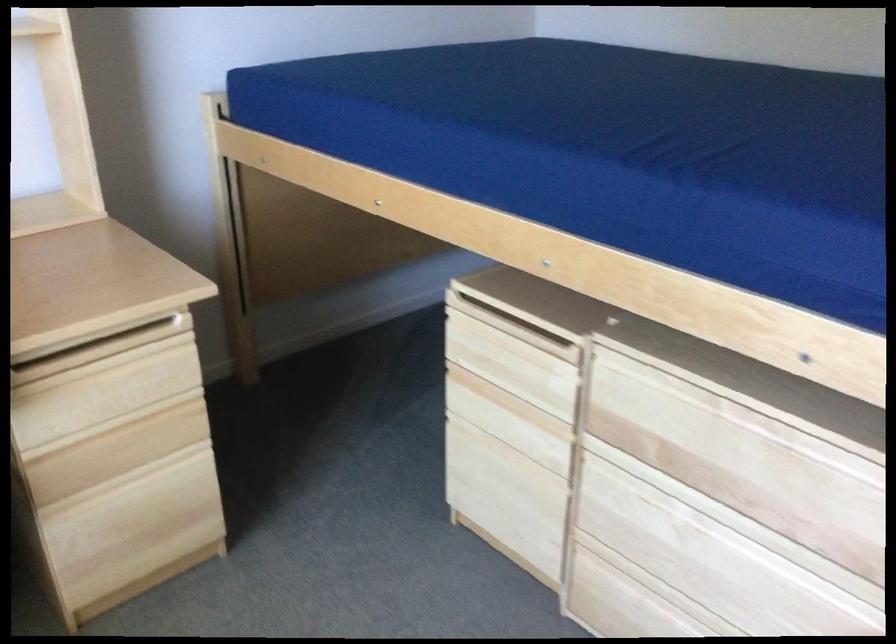
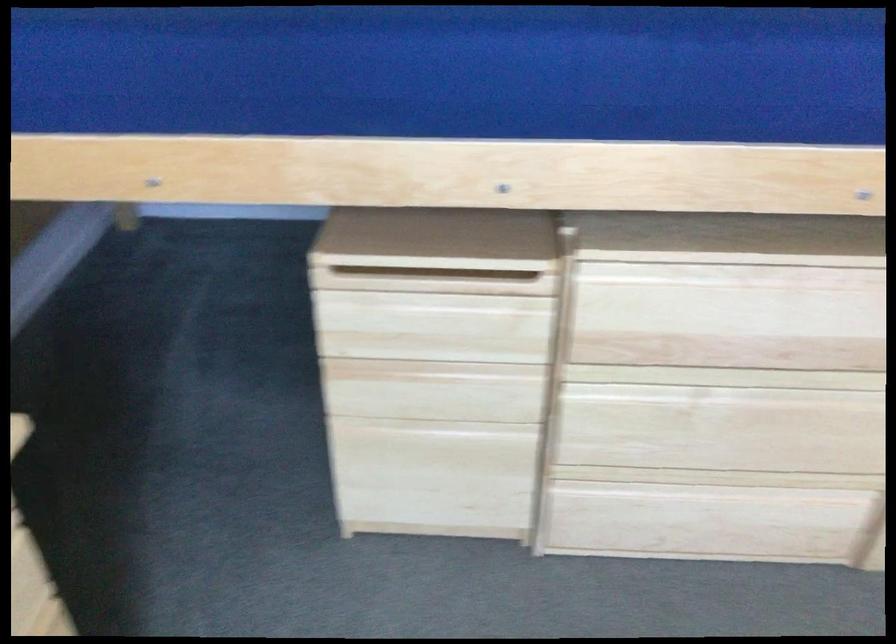
The first image is from the beginning of the video and the second image is from the end. How did the camera likely rotate when shooting the video?

The camera's rotation is toward right-down.